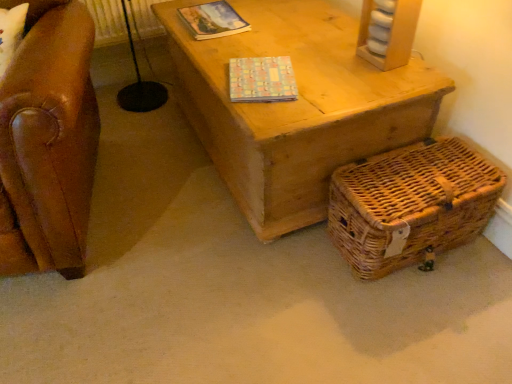
Question: Is pastel mosaic-patterned book at center, which is the 1th magazine in bottom-to-top order, inside the boundaries of multicolored paper book at upper center, which is the first magazine in top-to-bottom order, or outside?

Choices:
 (A) outside
 (B) inside

Answer: (A)

Question: From a real-world perspective, is pastel mosaic-patterned book at center, which is the 1th magazine in bottom-to-top order, above or below multicolored paper book at upper center, which is the first magazine in top-to-bottom order?

Choices:
 (A) below
 (B) above

Answer: (B)

Question: Considering the real-world distances, which object is farthest from the woven brown basket at lower right?

Choices:
 (A) pastel mosaic-patterned book at center, which is the 1th magazine in bottom-to-top order
 (B) multicolored paper book at upper center, which is the first magazine in top-to-bottom order

Answer: (B)

Question: Considering the real-world distances, which object is farthest from the multicolored paper book at upper center, the 1th magazine viewed from the back?

Choices:
 (A) pastel mosaic-patterned book at center, marked as the second magazine in a top-to-bottom arrangement
 (B) woven brown basket at lower right

Answer: (B)